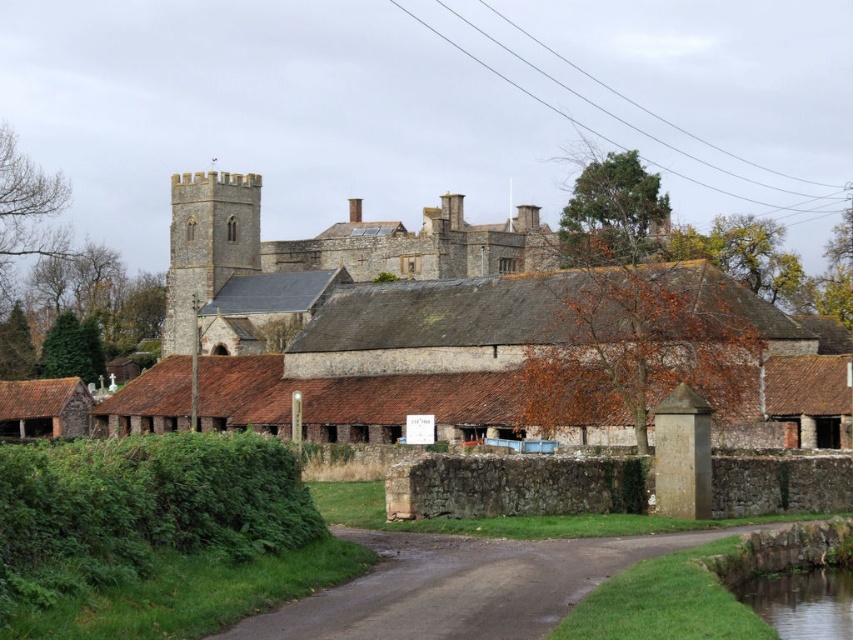
You are a photographer planning to capture the brown clay barns at center and the green grassy river at lower right in a single shot. Based on their heights, which object should you focus on first to ensure both are in frame?

The brown clay barns at center is taller than the green grassy river at lower right, so you should focus on the brown clay barns at center first to ensure both are in frame.

You are a delivery drone with a maximum flight range of 80 meters. You need to deliver a package to the damp asphalt road at center from the brown stone castle at center. Can you complete the delivery without needing to recharge?

The distance between the brown stone castle at center and the damp asphalt road at center is 76.48 meters, which is within your 80 meter range, so yes, the drone can complete the delivery without needing to recharge.

You are driving a delivery truck that is 12 meters long. You need to make a U turn on the damp asphalt road at center. Is there enough space for the truck to turn around without moving any objects?

The damp asphalt road at center is 29.30 meters long. Since the truck is 12 meters long, there is sufficient space to make a U turn without needing to move any objects.